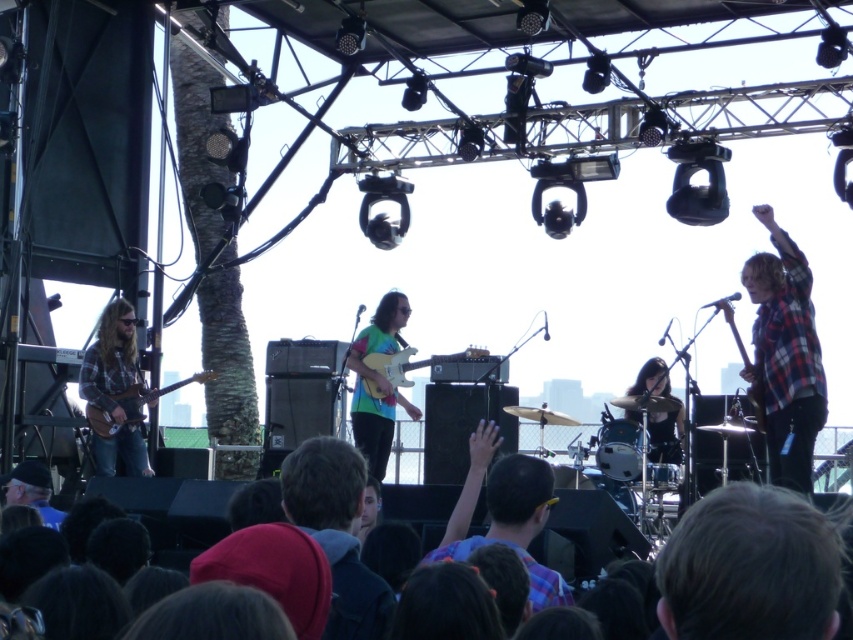
Is point (189, 380) positioned after point (663, 401)?

No, (189, 380) is in front of (663, 401).

Looking at this image, does wooden electric guitar at left have a lesser width compared to shiny black drum set at center?

No.

Is point (106, 435) closer to camera compared to point (653, 412)?

Yes.

Identify the location of wooden electric guitar at left. This screenshot has width=853, height=640. (132, 404).

Is plaid fabric shirt at center positioned before glossy wood electric guitar at center?

Yes, plaid fabric shirt at center is closer to the viewer.

Which of these two, plaid fabric shirt at center or glossy wood electric guitar at center, stands shorter?

With less height is glossy wood electric guitar at center.

Measure the distance between plaid fabric shirt at center and camera.

plaid fabric shirt at center is 157.47 feet away from camera.

Locate an element on the screen. Image resolution: width=853 pixels, height=640 pixels. plaid fabric shirt at center is located at coordinates (505, 513).

Which is more to the left, plaid flannel shirt at right or glossy wood electric guitar at center?

glossy wood electric guitar at center is more to the left.

The height and width of the screenshot is (640, 853). Identify the location of plaid flannel shirt at right. (785, 356).

Where is `plaid flannel shirt at right`? plaid flannel shirt at right is located at coordinates (785, 356).